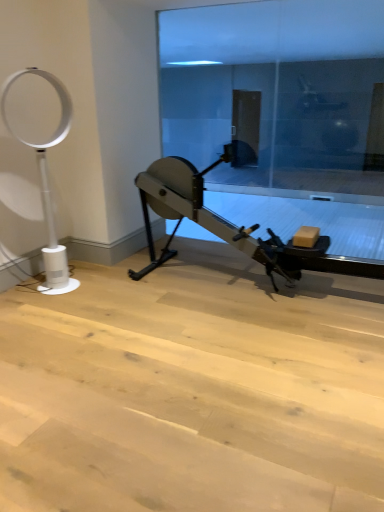
Find the location of `vacant area that lies between white plastic fan at left and metallic gray stationary bicycle at center`. vacant area that lies between white plastic fan at left and metallic gray stationary bicycle at center is located at coordinates (169, 293).